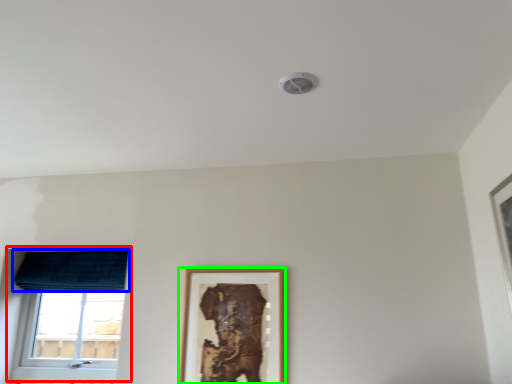
Question: Based on their relative distances, which object is farther from window (highlighted by a red box)? Choose from curtain (highlighted by a blue box) and picture frame (highlighted by a green box).

Choices:
 (A) curtain
 (B) picture frame

Answer: (B)